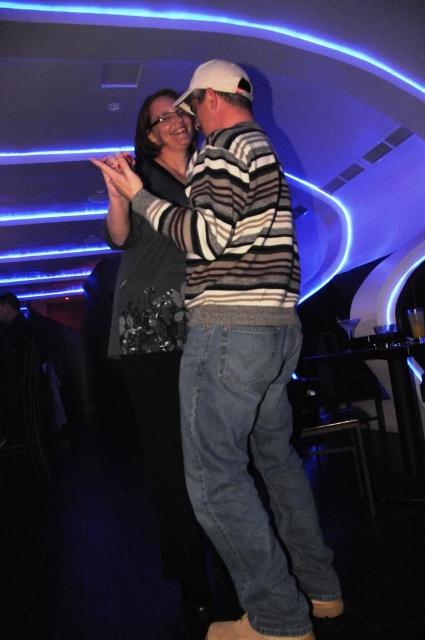
You are a photographer at the nightclub and want to capture a photo of both the striped sweater at center and the shiny silver dress at center without cropping either. If your camera has a fixed frame that can only accommodate objects up to the width of the narrower object, will both fit in the frame?

The striped sweater at center is wider than the shiny silver dress at center. Since the camera frame can only accommodate the width of the narrower object, which is the shiny silver dress at center, the striped sweater at center will not fit entirely within the frame.

Based on the photo, you are a photographer at the back of the nightclub trying to capture a photo of both the striped sweater at center and the shiny silver dress at center. Which one will appear larger in your photo?

The striped sweater at center will appear larger in the photo because it is closer to the viewer than the shiny silver dress at center.

You are a photographer at the nightclub and want to capture a photo of the striped sweater at center and the shiny silver dress at center. To ensure both are in focus, you need to know their vertical positions. Which one is lower in the image?

The striped sweater at center is located below the shiny silver dress at center, so it is lower in the image.